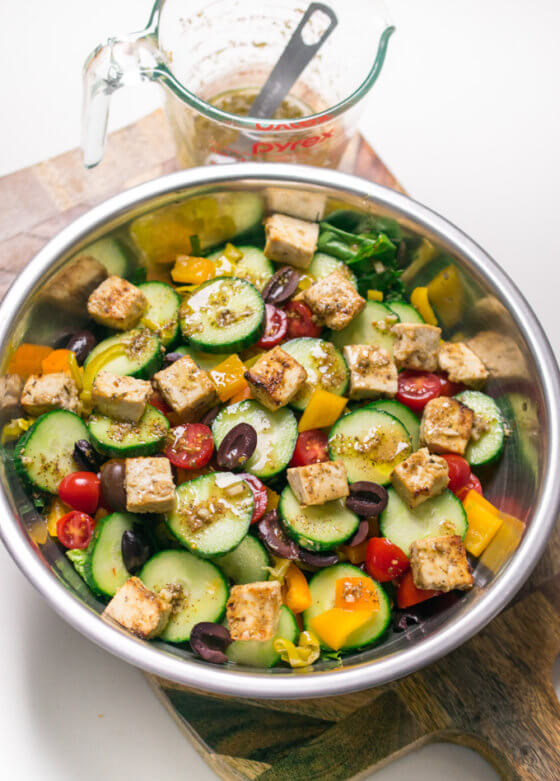
I want to click on shadow from bowl, so click(x=153, y=735).